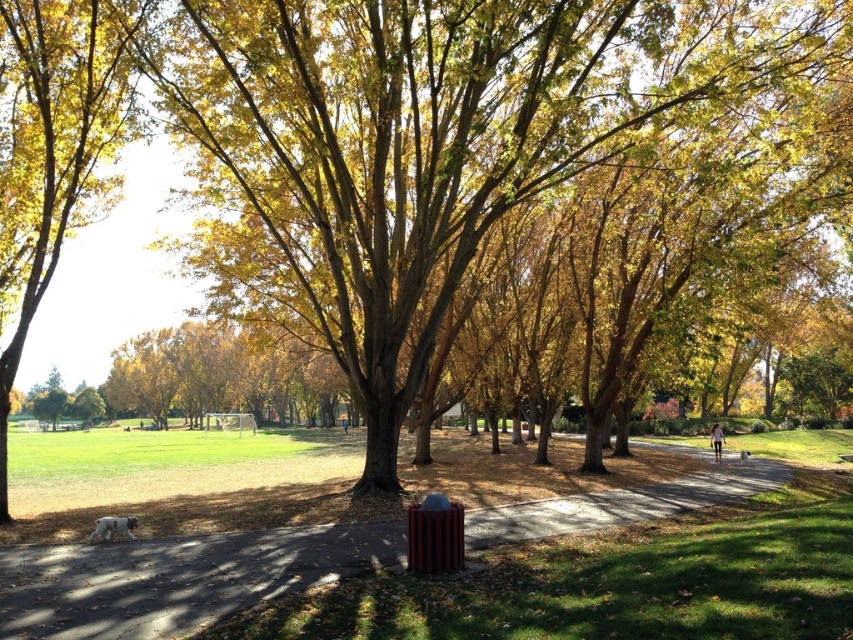
Is the position of metallic trash can at center more distant than that of golden leafy tree at center?

No.

Is metallic trash can at center in front of golden leafy tree at center?

That is True.

Between point (154, 557) and point (97, 148), which one is positioned behind?

The point (97, 148) is more distant.

Image resolution: width=853 pixels, height=640 pixels. Identify the location of metallic trash can at center. (178, 577).